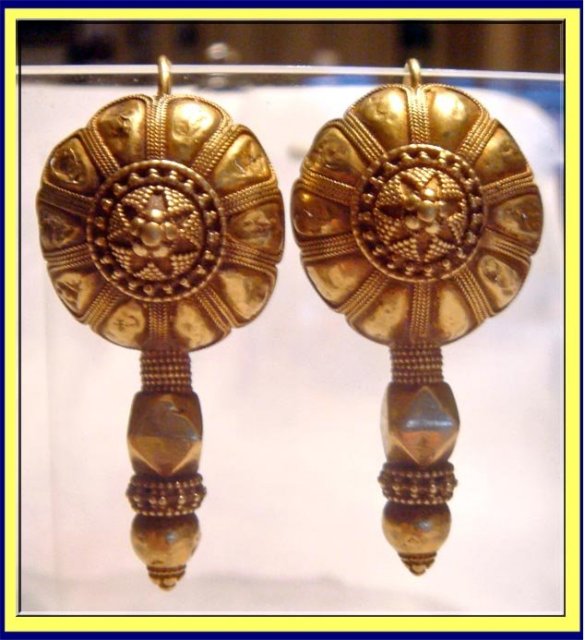
Identify the location of hanging pole. The width and height of the screenshot is (585, 640). (261, 73).